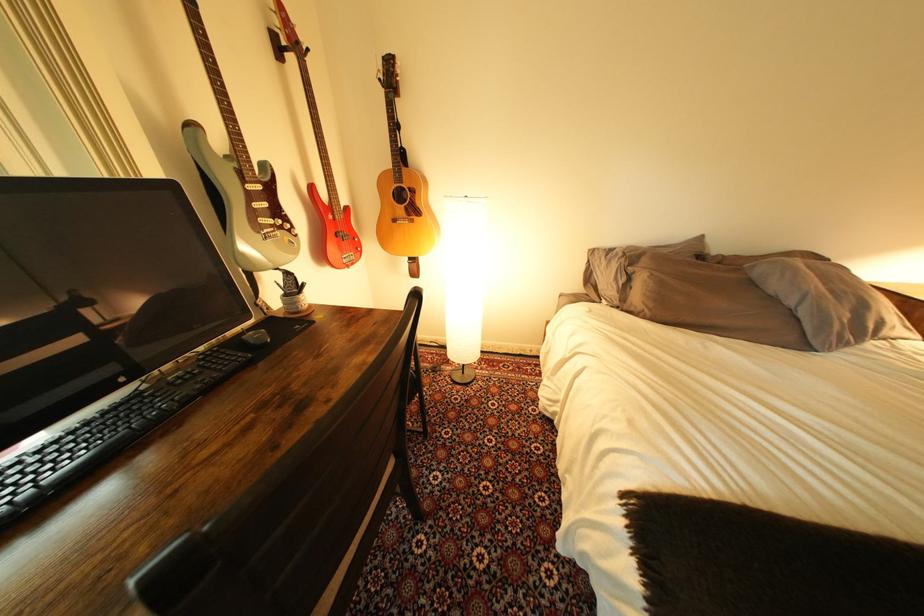
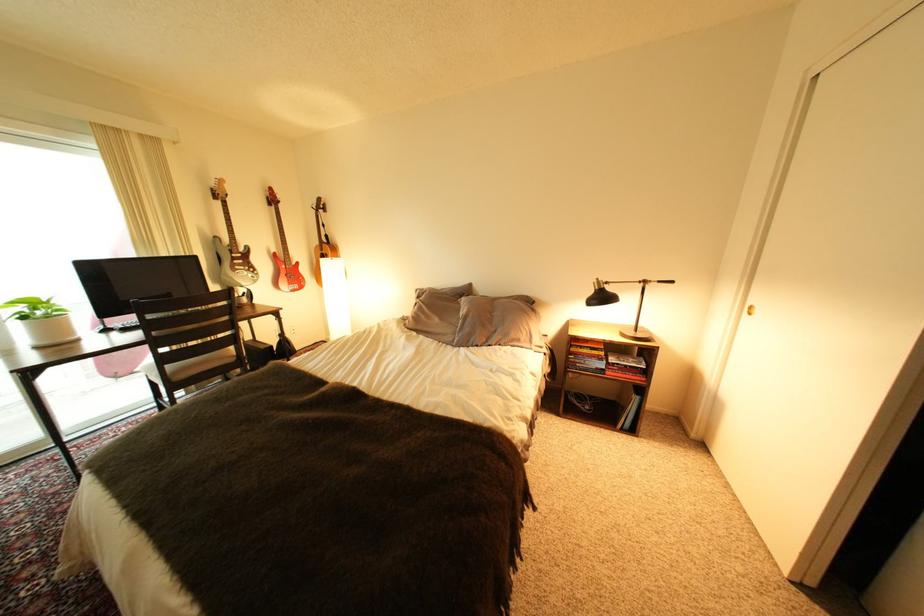
In the second image, find the point that corresponds to pixel 767 268 in the first image.

(473, 302)